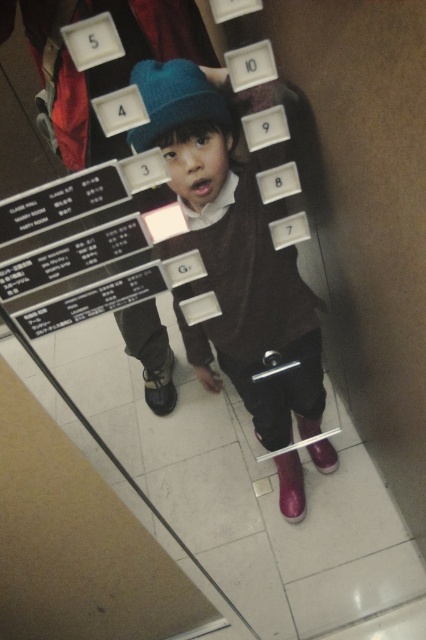
Can you confirm if velvet brown sweater at center is positioned above shiny purple boot at lower center?

Yes, velvet brown sweater at center is above shiny purple boot at lower center.

Find the location of a particular element. Image resolution: width=426 pixels, height=640 pixels. velvet brown sweater at center is located at coordinates (233, 244).

Who is positioned more to the left, teal knit hat at center or shiny purple shoe at lower center?

teal knit hat at center is more to the left.

Between point (178, 61) and point (319, 419), which one is positioned in front?

Point (178, 61) is in front.

Find the location of a particular element. teal knit hat at center is located at coordinates (175, 100).

Does teal knit hat at center appear under shiny purple boot at lower center?

No.

Is teal knit hat at center above shiny purple boot at lower center?

Yes.

Find the location of `teal knit hat at center`. teal knit hat at center is located at coordinates (175, 100).